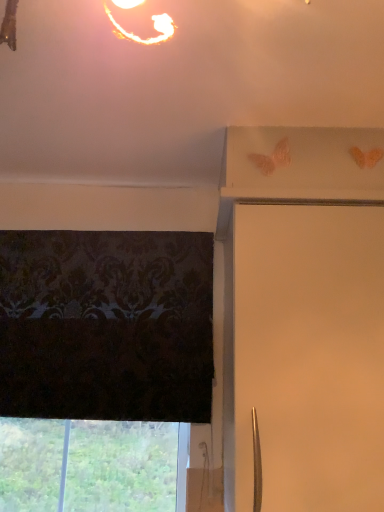
Describe the element at coordinates (308, 357) in the screenshot. This screenshot has height=512, width=384. I see `white matte shutter at upper right` at that location.

The height and width of the screenshot is (512, 384). What are the coordinates of `white matte shutter at upper right` in the screenshot? It's located at (308, 357).

Describe the element at coordinates (121, 466) in the screenshot. I see `transparent glass window at lower left` at that location.

Identify the location of transparent glass window at lower left. (121, 466).

In order to click on white matte shutter at upper right in this screenshot , I will do `click(308, 357)`.

Is transparent glass window at lower left to the right of white matte shutter at upper right from the viewer's perspective?

No, transparent glass window at lower left is not to the right of white matte shutter at upper right.

Is transparent glass window at lower left in front of or behind white matte shutter at upper right in the image?

transparent glass window at lower left is behind white matte shutter at upper right.

Does point (42, 467) come closer to viewer compared to point (307, 348)?

That is False.

From the image's perspective, is transparent glass window at lower left above or below white matte shutter at upper right?

From the image's perspective, transparent glass window at lower left appears below white matte shutter at upper right.

From a real-world perspective, is transparent glass window at lower left positioned over white matte shutter at upper right based on gravity?

No, from a real-world perspective, transparent glass window at lower left is not on top of white matte shutter at upper right.

Is transparent glass window at lower left wider or thinner than white matte shutter at upper right?

Clearly, transparent glass window at lower left has less width compared to white matte shutter at upper right.

From their relative heights in the image, would you say transparent glass window at lower left is taller or shorter than white matte shutter at upper right?

In the image, transparent glass window at lower left appears to be shorter than white matte shutter at upper right.

Which of these two, transparent glass window at lower left or white matte shutter at upper right, is bigger?

With larger size is white matte shutter at upper right.

Based on the photo, could white matte shutter at upper right be considered to be inside transparent glass window at lower left?

No, white matte shutter at upper right is not inside transparent glass window at lower left.

Consider the image. Are transparent glass window at lower left and white matte shutter at upper right located far from each other?

transparent glass window at lower left is actually quite close to white matte shutter at upper right.

Does transparent glass window at lower left turn towards white matte shutter at upper right?

No, transparent glass window at lower left does not turn towards white matte shutter at upper right.

How different are the orientations of transparent glass window at lower left and white matte shutter at upper right in degrees?

The angular difference between transparent glass window at lower left and white matte shutter at upper right is 1.47 degrees.

Where is `shutter located in front of the transparent glass window at lower left`? The height and width of the screenshot is (512, 384). shutter located in front of the transparent glass window at lower left is located at coordinates (308, 357).

Is white matte shutter at upper right at the right side of transparent glass window at lower left?

Indeed, white matte shutter at upper right is positioned on the right side of transparent glass window at lower left.

Is white matte shutter at upper right behind transparent glass window at lower left?

That is False.

Which is nearer, [309,266] or [148,481]?

Point [309,266] is closer to the camera than point [148,481].

From the picture: From the image's perspective, which is above, white matte shutter at upper right or transparent glass window at lower left?

From the image's view, white matte shutter at upper right is above.

From a real-world perspective, between white matte shutter at upper right and transparent glass window at lower left, who is vertically higher?

white matte shutter at upper right, from a real-world perspective.

Considering the sizes of objects white matte shutter at upper right and transparent glass window at lower left in the image provided, who is wider, white matte shutter at upper right or transparent glass window at lower left?

Wider between the two is white matte shutter at upper right.

Can you confirm if white matte shutter at upper right is taller than transparent glass window at lower left?

Correct, white matte shutter at upper right is much taller as transparent glass window at lower left.

Looking at this image, considering the sizes of objects white matte shutter at upper right and transparent glass window at lower left in the image provided, who is bigger, white matte shutter at upper right or transparent glass window at lower left?

white matte shutter at upper right.

Is white matte shutter at upper right outside of transparent glass window at lower left?

Yes, white matte shutter at upper right is outside of transparent glass window at lower left.

Is white matte shutter at upper right positioned far away from transparent glass window at lower left?

white matte shutter at upper right is actually quite close to transparent glass window at lower left.

Is white matte shutter at upper right facing towards transparent glass window at lower left?

No, white matte shutter at upper right is not turned towards transparent glass window at lower left.

How much distance is there between white matte shutter at upper right and transparent glass window at lower left?

A distance of 27.41 inches exists between white matte shutter at upper right and transparent glass window at lower left.

Find the location of `shutter in front of the transparent glass window at lower left`. shutter in front of the transparent glass window at lower left is located at coordinates (308, 357).

The image size is (384, 512). Identify the location of window on the left of white matte shutter at upper right. (121, 466).

The width and height of the screenshot is (384, 512). What are the coordinates of `shutter lying in front of the transparent glass window at lower left` in the screenshot? It's located at (308, 357).